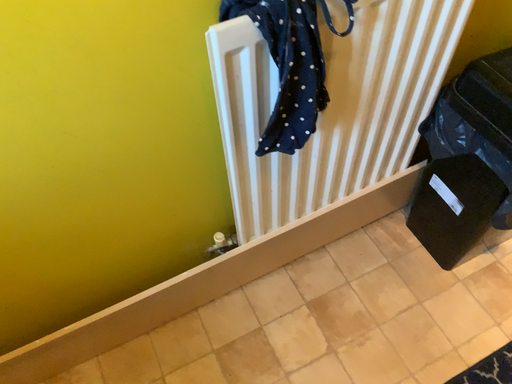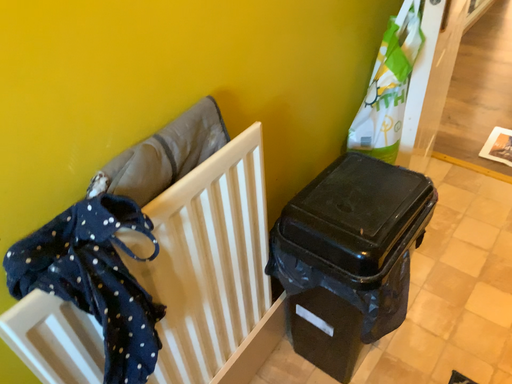
Question: Which way did the camera rotate in the video?

Choices:
 (A) rotated downward
 (B) rotated upward

Answer: (B)